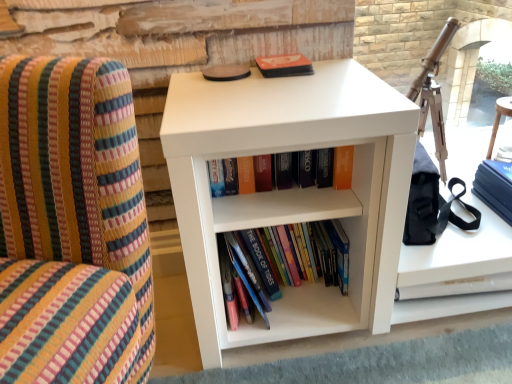
What is the approximate width of blue matte paperback book at right, which is counted as the second paperback book, starting from the top?

9.15 inches.

What do you see at coordinates (325, 167) in the screenshot?
I see `matte orange book at center, which ranks as the 1th book in top-to-bottom order` at bounding box center [325, 167].

The height and width of the screenshot is (384, 512). I want to click on blue matte paperback book at right, the first paperback book from the right, so click(495, 187).

Which of these two, blue matte paperback book at right, which is the first paperback book from bottom to top, or white matte cabinet at lower right, stands shorter?

white matte cabinet at lower right is shorter.

Is blue matte paperback book at right, the first paperback book from the right, aimed at white matte cabinet at lower right?

No, blue matte paperback book at right, the first paperback book from the right, is not facing towards white matte cabinet at lower right.

At what (x,y) coordinates should I click in order to perform the action: click on the 1st paperback book above the white matte cabinet at lower right (from the image's perspective). Please return your answer as a coordinate pair (x, y). This screenshot has width=512, height=384. Looking at the image, I should click on (495, 187).

From a real-world perspective, is blue matte paperback book at right, the first paperback book from the right, physically above white matte cabinet at lower right?

Indeed, from a real-world perspective, blue matte paperback book at right, the first paperback book from the right, stands above white matte cabinet at lower right.

How distant is blue matte paperback book at right, which is the 2th paperback book in left-to-right order, from hardcover books at center, positioned as the second book in top-to-bottom order?

19.07 inches.

In the scene shown: From their relative heights in the image, would you say blue matte paperback book at right, which is the 2th paperback book in left-to-right order, is taller or shorter than hardcover books at center, arranged as the 1th book when ordered from the bottom?

Considering their sizes, blue matte paperback book at right, which is the 2th paperback book in left-to-right order, has less height than hardcover books at center, arranged as the 1th book when ordered from the bottom.

Is blue matte paperback book at right, which is the 2th paperback book in left-to-right order, inside the boundaries of hardcover books at center, positioned as the second book in top-to-bottom order, or outside?

blue matte paperback book at right, which is the 2th paperback book in left-to-right order, is not inside hardcover books at center, positioned as the second book in top-to-bottom order, it's outside.

Is there a large distance between white matte cabinet at lower right and white matte bookshelf at center?

No, white matte cabinet at lower right is not far from white matte bookshelf at center.

From a real-world perspective, is white matte cabinet at lower right above or below white matte bookshelf at center?

white matte cabinet at lower right is situated lower than white matte bookshelf at center in the real world.

How many degrees apart are the facing directions of white matte cabinet at lower right and white matte bookshelf at center?

The angle between the facing direction of white matte cabinet at lower right and the facing direction of white matte bookshelf at center is 0.0802 degrees.

Which of these two, white matte cabinet at lower right or white matte bookshelf at center, stands shorter?

With less height is white matte cabinet at lower right.

Is hardcover books at center, positioned as the second book in top-to-bottom order, turned away from white matte bookshelf at center?

Yes, hardcover books at center, positioned as the second book in top-to-bottom order,'s orientation is away from white matte bookshelf at center.

Looking at their sizes, would you say hardcover books at center, arranged as the 1th book when ordered from the bottom, is wider or thinner than white matte bookshelf at center?

Considering their sizes, hardcover books at center, arranged as the 1th book when ordered from the bottom, looks slimmer than white matte bookshelf at center.

Is hardcover books at center, arranged as the 1th book when ordered from the bottom, positioned beyond the bounds of white matte bookshelf at center?

No, hardcover books at center, arranged as the 1th book when ordered from the bottom, is inside or overlapping with white matte bookshelf at center.

Does hardcover books at center, positioned as the second book in top-to-bottom order, have a lesser height compared to white matte bookshelf at center?

Yes, hardcover books at center, positioned as the second book in top-to-bottom order, is shorter than white matte bookshelf at center.

Is matte orange paperback book at upper center, marked as the second paperback book in a right-to-left arrangement, far away from hardcover books at center, positioned as the second book in top-to-bottom order?

No, matte orange paperback book at upper center, marked as the second paperback book in a right-to-left arrangement, is in close proximity to hardcover books at center, positioned as the second book in top-to-bottom order.

Does matte orange paperback book at upper center, the first paperback book in the top-to-bottom sequence, appear on the right side of hardcover books at center, arranged as the 1th book when ordered from the bottom?

Answer: No, matte orange paperback book at upper center, the first paperback book in the top-to-bottom sequence, is not to the right of hardcover books at center, arranged as the 1th book when ordered from the bottom.

Which of these two, matte orange paperback book at upper center, marked as the second paperback book in a right-to-left arrangement, or hardcover books at center, arranged as the 1th book when ordered from the bottom, is thinner?

matte orange paperback book at upper center, marked as the second paperback book in a right-to-left arrangement.

Could you tell me if matte orange paperback book at upper center, marked as the first paperback book in a left-to-right arrangement, is turned towards hardcover books at center, arranged as the 1th book when ordered from the bottom?

No, matte orange paperback book at upper center, marked as the first paperback book in a left-to-right arrangement, is not aimed at hardcover books at center, arranged as the 1th book when ordered from the bottom.

Looking at their sizes, would you say white matte cabinet at lower right is wider or thinner than matte orange paperback book at upper center, the 2th paperback book in the bottom-to-top sequence?

Clearly, white matte cabinet at lower right has more width compared to matte orange paperback book at upper center, the 2th paperback book in the bottom-to-top sequence.

Is the surface of white matte cabinet at lower right in direct contact with matte orange paperback book at upper center, the 2th paperback book in the bottom-to-top sequence?

white matte cabinet at lower right is not next to matte orange paperback book at upper center, the 2th paperback book in the bottom-to-top sequence, and they're not touching.

Which object is positioned more to the right, white matte cabinet at lower right or matte orange paperback book at upper center, the first paperback book in the top-to-bottom sequence?

Positioned to the right is white matte cabinet at lower right.

From a real-world perspective, does white matte cabinet at lower right sit lower than matte orange paperback book at upper center, marked as the first paperback book in a left-to-right arrangement?

Yes, from a real-world perspective, white matte cabinet at lower right is under matte orange paperback book at upper center, marked as the first paperback book in a left-to-right arrangement.

From the image's perspective, does matte orange paperback book at upper center, the 2th paperback book in the bottom-to-top sequence, appear higher than blue matte paperback book at right, which is the first paperback book from bottom to top?

Yes, from the image's perspective, matte orange paperback book at upper center, the 2th paperback book in the bottom-to-top sequence, is above blue matte paperback book at right, which is the first paperback book from bottom to top.

Between matte orange paperback book at upper center, the 2th paperback book in the bottom-to-top sequence, and blue matte paperback book at right, which is the first paperback book from bottom to top, which one is positioned behind?

matte orange paperback book at upper center, the 2th paperback book in the bottom-to-top sequence, is more distant.

Considering the relative positions of matte orange paperback book at upper center, the 2th paperback book in the bottom-to-top sequence, and blue matte paperback book at right, which is the 2th paperback book in left-to-right order, in the image provided, is matte orange paperback book at upper center, the 2th paperback book in the bottom-to-top sequence, to the left or to the right of blue matte paperback book at right, which is the 2th paperback book in left-to-right order,?

Based on their positions, matte orange paperback book at upper center, the 2th paperback book in the bottom-to-top sequence, is located to the left of blue matte paperback book at right, which is the 2th paperback book in left-to-right order.

Identify the location of cabinet on the left of blue matte paperback book at right, which is counted as the second paperback book, starting from the top. The height and width of the screenshot is (384, 512). (456, 270).

Locate an element on the screen. This screenshot has height=384, width=512. paperback book that is the 1st object located above the hardcover books at center, arranged as the 1th book when ordered from the bottom (from the image's perspective) is located at coordinates (495, 187).

From the picture: Estimate the real-world distances between objects in this image. Which object is closer to matte orange book at center, positioned as the second book in bottom-to-top order, matte orange paperback book at upper center, the first paperback book in the top-to-bottom sequence, or hardcover books at center, positioned as the second book in top-to-bottom order?

Based on the image, hardcover books at center, positioned as the second book in top-to-bottom order, appears to be nearer to matte orange book at center, positioned as the second book in bottom-to-top order.

Considering their positions, is matte orange paperback book at upper center, the 2th paperback book in the bottom-to-top sequence, positioned further to matte orange book at center, positioned as the second book in bottom-to-top order, than white matte cabinet at lower right?

white matte cabinet at lower right.

Considering their positions, is matte orange paperback book at upper center, the 2th paperback book in the bottom-to-top sequence, positioned closer to matte orange book at center, which ranks as the 1th book in top-to-bottom order, than white matte bookshelf at center?

white matte bookshelf at center lies closer to matte orange book at center, which ranks as the 1th book in top-to-bottom order, than the other object.

Based on their spatial positions, is matte orange paperback book at upper center, the 2th paperback book in the bottom-to-top sequence, or blue matte paperback book at right, which is counted as the second paperback book, starting from the top, further from white matte bookshelf at center?

blue matte paperback book at right, which is counted as the second paperback book, starting from the top, is further to white matte bookshelf at center.

Which object lies further to the anchor point white matte bookshelf at center, hardcover books at center, positioned as the second book in top-to-bottom order, or matte orange paperback book at upper center, marked as the first paperback book in a left-to-right arrangement?

matte orange paperback book at upper center, marked as the first paperback book in a left-to-right arrangement.

From the image, which object appears to be nearer to blue matte paperback book at right, the first paperback book from the right, matte orange paperback book at upper center, the 2th paperback book in the bottom-to-top sequence, or matte orange book at center, which ranks as the 1th book in top-to-bottom order?

matte orange book at center, which ranks as the 1th book in top-to-bottom order, is closer to blue matte paperback book at right, the first paperback book from the right.

From the image, which object appears to be nearer to hardcover books at center, arranged as the 1th book when ordered from the bottom, white matte bookshelf at center or white matte cabinet at lower right?

white matte bookshelf at center lies closer to hardcover books at center, arranged as the 1th book when ordered from the bottom, than the other object.

Estimate the real-world distances between objects in this image. Which object is closer to blue matte paperback book at right, which is the first paperback book from bottom to top, matte orange book at center, which ranks as the 1th book in top-to-bottom order, or matte orange paperback book at upper center, the first paperback book in the top-to-bottom sequence?

matte orange book at center, which ranks as the 1th book in top-to-bottom order.

Where is `book situated between matte orange book at center, positioned as the second book in bottom-to-top order, and white matte cabinet at lower right from left to right`? book situated between matte orange book at center, positioned as the second book in bottom-to-top order, and white matte cabinet at lower right from left to right is located at coordinates (263, 263).

The width and height of the screenshot is (512, 384). Find the location of `shelf between hardcover books at center, arranged as the 1th book when ordered from the bottom, and blue matte paperback book at right, the first paperback book from the right`. shelf between hardcover books at center, arranged as the 1th book when ordered from the bottom, and blue matte paperback book at right, the first paperback book from the right is located at coordinates (292, 190).

Identify the location of shelf between matte orange paperback book at upper center, the first paperback book in the top-to-bottom sequence, and white matte cabinet at lower right from top to bottom. The width and height of the screenshot is (512, 384). (292, 190).

In order to click on book located between matte orange paperback book at upper center, the 2th paperback book in the bottom-to-top sequence, and blue matte paperback book at right, which is counted as the second paperback book, starting from the top, in the left-right direction in this screenshot , I will do `click(263, 263)`.